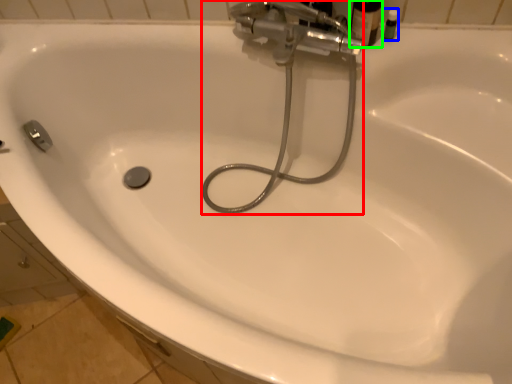
Question: Estimate the real-world distances between objects in this image. Which object is closer to plumbing fixture (highlighted by a red box), toiletry (highlighted by a blue box) or toiletry (highlighted by a green box)?

Choices:
 (A) toiletry
 (B) toiletry

Answer: (B)